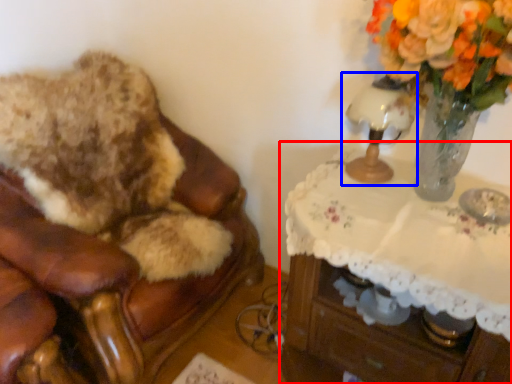
Question: Which object appears farthest to the camera in this image, table (highlighted by a red box) or table lamp (highlighted by a blue box)?

Choices:
 (A) table
 (B) table lamp

Answer: (B)